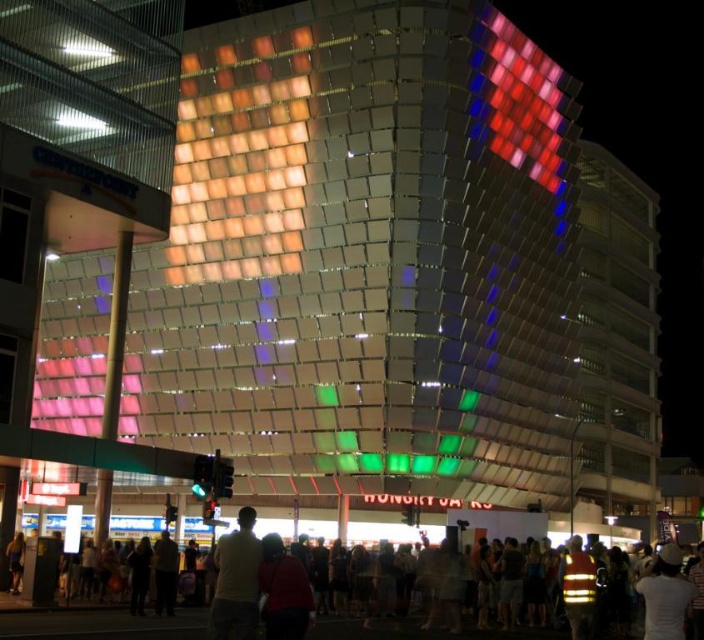
Is white matte shirt at center shorter than dark blue jeans at lower left?

No.

Describe the element at coordinates (237, 580) in the screenshot. Image resolution: width=704 pixels, height=640 pixels. I see `white matte shirt at center` at that location.

Where is `white matte shirt at center`? This screenshot has height=640, width=704. white matte shirt at center is located at coordinates (237, 580).

Does dark gray shirt at center lie in front of white matte shirt at center?

No.

Is dark gray shirt at center above white matte shirt at center?

No.

Is point (184, 624) less distant than point (219, 637)?

No, (184, 624) is behind (219, 637).

Locate an element on the screen. The width and height of the screenshot is (704, 640). dark gray shirt at center is located at coordinates (99, 625).

Between point (484, 636) and point (8, 556), which one is positioned in front?

Positioned in front is point (484, 636).

Between dark gray shirt at center and dark blue jeans at lower left, which one has less height?

dark blue jeans at lower left

Image resolution: width=704 pixels, height=640 pixels. What are the coordinates of `dark gray shirt at center` in the screenshot? It's located at (99, 625).